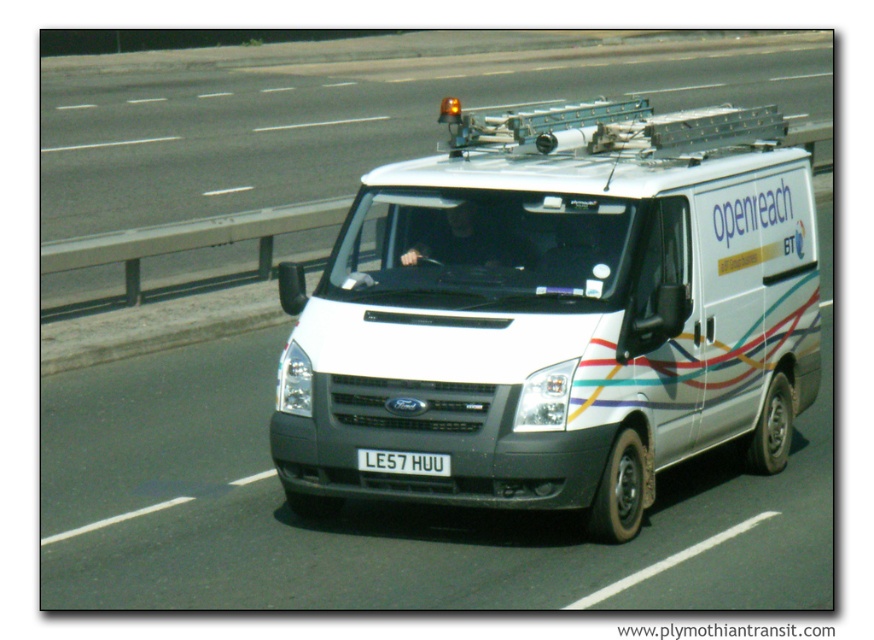
Question: Considering the real-world distances, which object is farthest from the white matte van at center?

Choices:
 (A) white plastic license plate at center
 (B) white van at center

Answer: (B)

Question: In this image, where is white matte van at center located relative to white van at center?

Choices:
 (A) above
 (B) below

Answer: (B)

Question: Which point appears closest to the camera in this image?

Choices:
 (A) (246, 116)
 (B) (392, 465)
 (C) (494, 330)

Answer: (B)

Question: Can you confirm if white matte van at center is positioned above white van at center?

Choices:
 (A) yes
 (B) no

Answer: (B)

Question: Which of these objects is positioned farthest from the white van at center?

Choices:
 (A) white plastic license plate at center
 (B) white matte van at center

Answer: (A)

Question: Observing the image, what is the correct spatial positioning of white van at center in reference to white plastic license plate at center?

Choices:
 (A) right
 (B) left

Answer: (B)